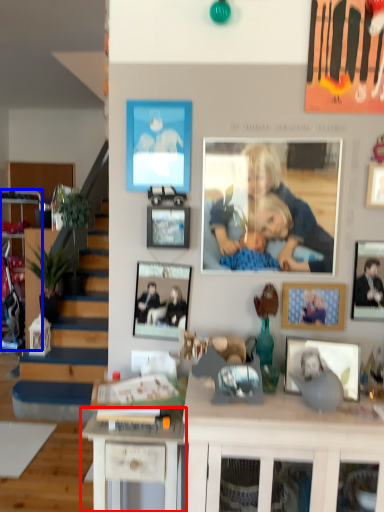
Question: Which object appears closest to the camera in this image, desk (highlighted by a red box) or cabinetry (highlighted by a blue box)?

Choices:
 (A) desk
 (B) cabinetry

Answer: (A)